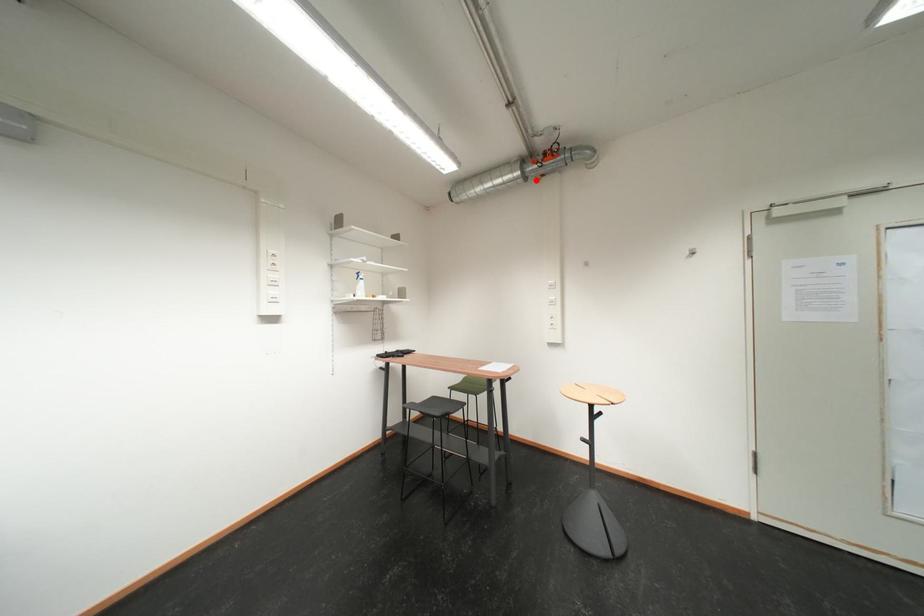
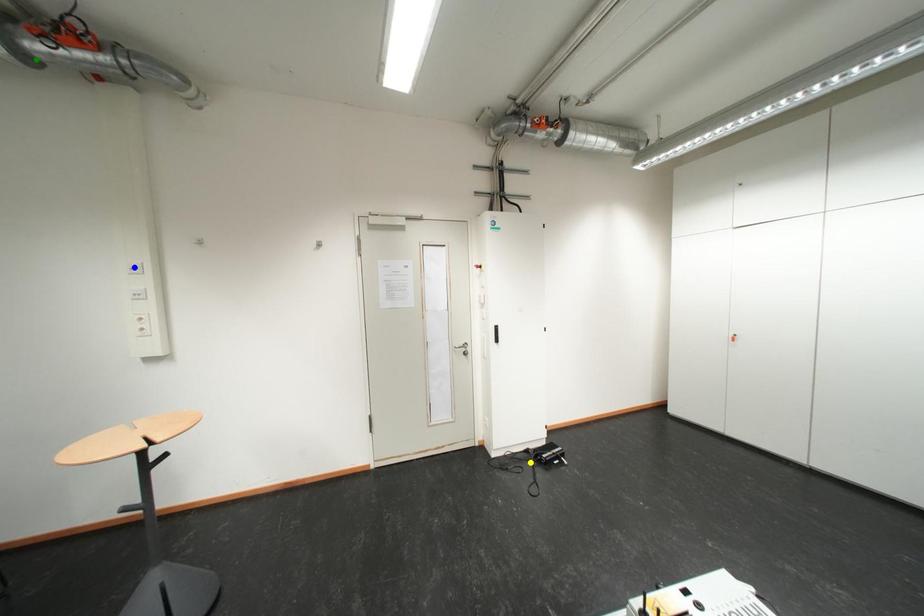
Question: I am providing you with two images of the same scene from different viewpoints. A red point is marked on the first image. You are given multiple points on the second image. Which mark in image 2 goes with the point in image 1?

Choices:
 (A) blue point
 (B) green point
 (C) yellow point

Answer: (B)